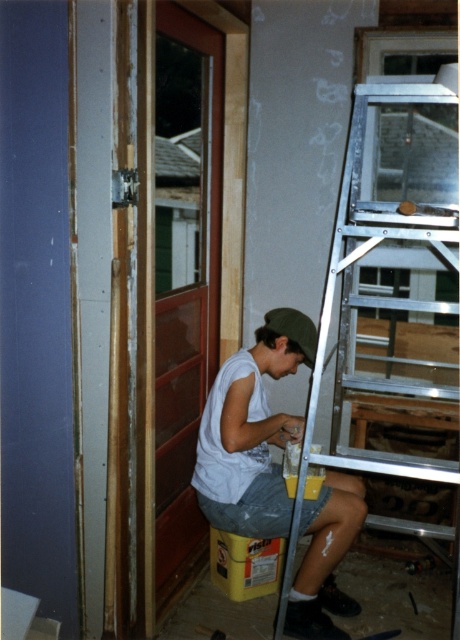
Question: Among these points, which one is nearest to the camera?

Choices:
 (A) (253, 472)
 (B) (343, 468)

Answer: (A)

Question: In this image, where is silver metallic ladder at right located relative to white matte shirt at center?

Choices:
 (A) right
 (B) left

Answer: (A)

Question: Is silver metallic ladder at right to the left of white matte shirt at center from the viewer's perspective?

Choices:
 (A) yes
 (B) no

Answer: (B)

Question: Which point appears closest to the camera in this image?

Choices:
 (A) (236, 515)
 (B) (442, 225)

Answer: (B)

Question: Is silver metallic ladder at right positioned at the back of white matte shirt at center?

Choices:
 (A) no
 (B) yes

Answer: (A)